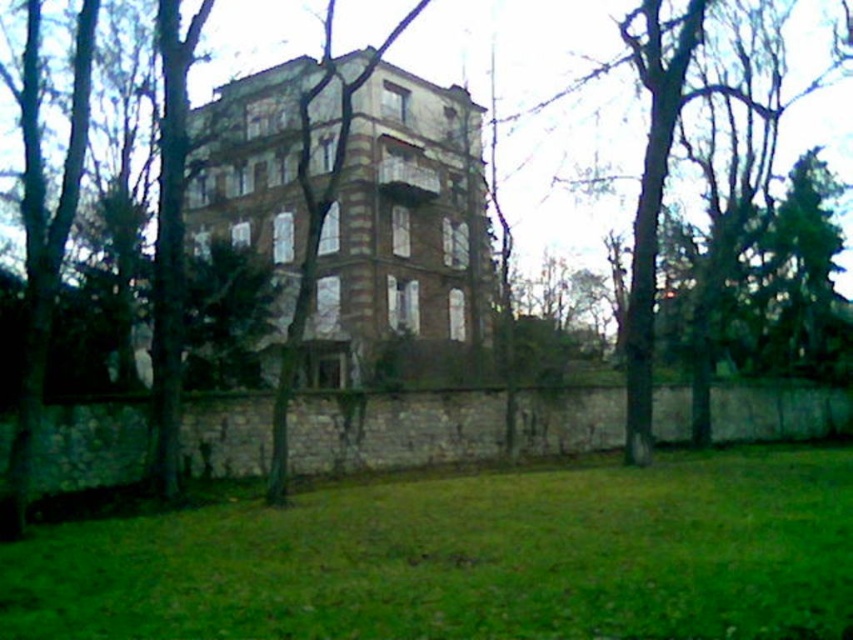
Question: Is green grass at lower center thinner than brown textured building at center?

Choices:
 (A) no
 (B) yes

Answer: (A)

Question: Can you confirm if green grass at lower center is positioned below brown textured building at center?

Choices:
 (A) yes
 (B) no

Answer: (A)

Question: Which of the following is the closest to the observer?

Choices:
 (A) (268, 484)
 (B) (757, 518)

Answer: (B)

Question: Observing the image, what is the correct spatial positioning of green grass at lower center in reference to brown textured building at center?

Choices:
 (A) right
 (B) left

Answer: (A)

Question: Among these points, which one is farthest from the camera?

Choices:
 (A) (303, 156)
 (B) (409, 572)

Answer: (A)